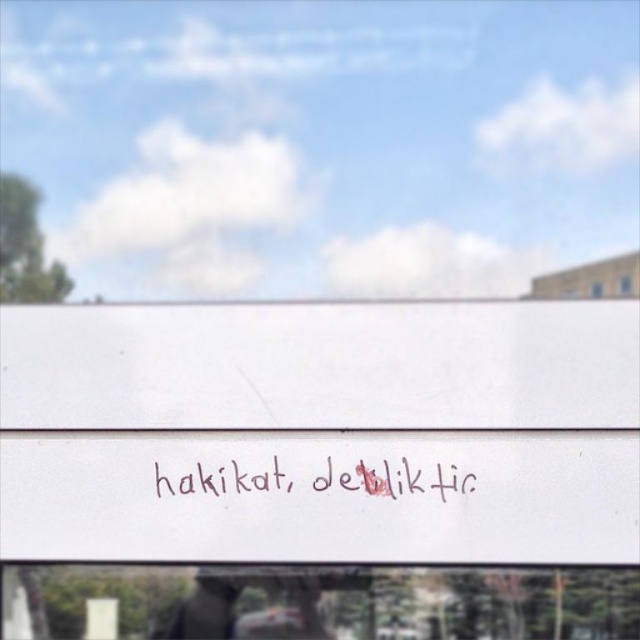
Is transparent glass window at lower center closer to camera compared to handwritten text at center?

Yes, it is in front of handwritten text at center.

The image size is (640, 640). Describe the element at coordinates (317, 602) in the screenshot. I see `transparent glass window at lower center` at that location.

I want to click on transparent glass window at lower center, so click(x=317, y=602).